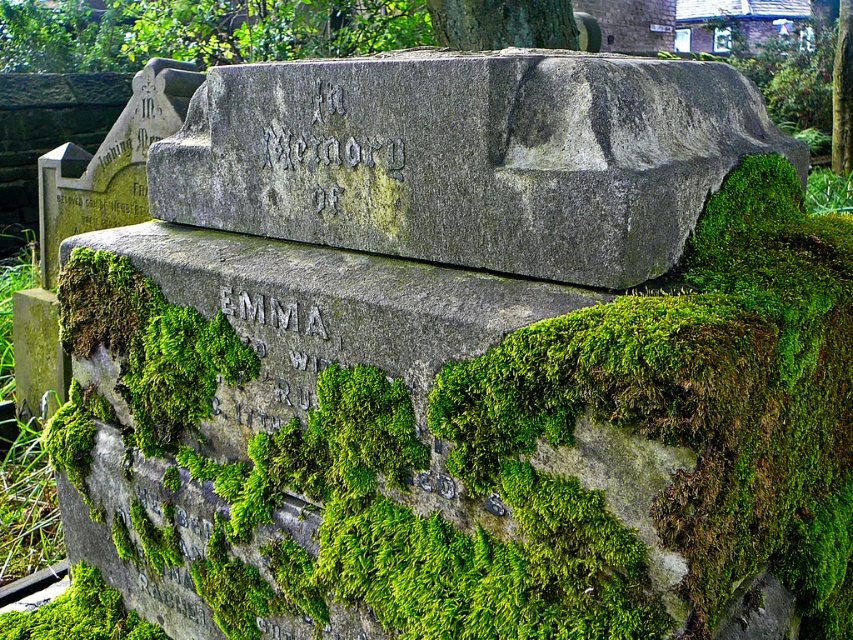
Question: Can you confirm if green mossy stone at center is positioned below gray stone boulder at center?

Choices:
 (A) yes
 (B) no

Answer: (A)

Question: Can you confirm if green mossy stone at center is wider than gray stone boulder at center?

Choices:
 (A) no
 (B) yes

Answer: (B)

Question: Among these objects, which one is farthest from the camera?

Choices:
 (A) gray stone boulder at center
 (B) green mossy stone at center

Answer: (A)

Question: Does green mossy stone at center come in front of gray stone boulder at center?

Choices:
 (A) no
 (B) yes

Answer: (B)